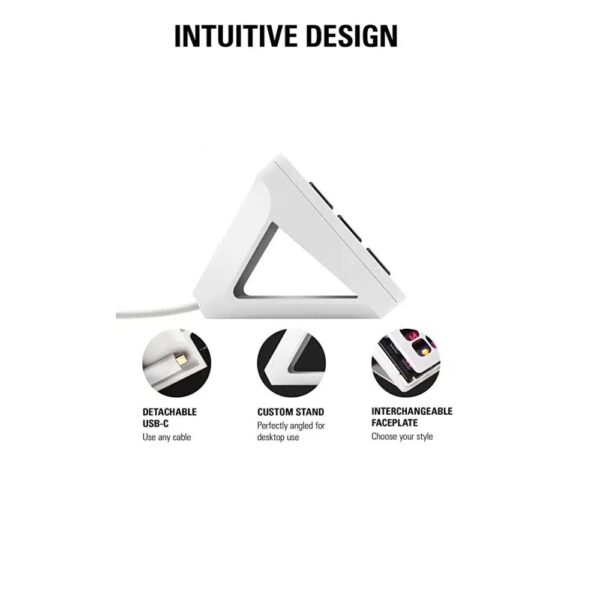
This screenshot has width=600, height=600. What are the coordinates of `power cord` in the screenshot? It's located at (152, 313).